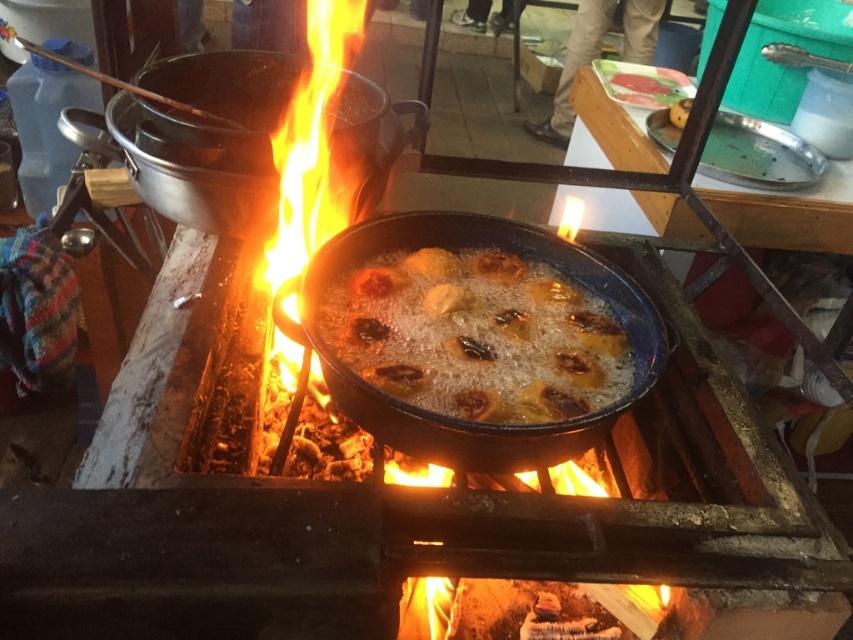
Question: Which of the following is the farthest from the observer?

Choices:
 (A) black cast iron frying pan at center
 (B) smooth yellowish-brown pastry at center

Answer: (B)

Question: Which of these objects is positioned farthest from the black cast iron frying pan at center?

Choices:
 (A) khaki fabric pants at upper center
 (B) golden crispy fried balls at center
 (C) bright orange flame at center

Answer: (A)

Question: Can you confirm if golden crispy fried balls at center is smaller than bright orange flame at center?

Choices:
 (A) no
 (B) yes

Answer: (B)

Question: Can you confirm if black cast iron frying pan at center is positioned to the left of smooth yellowish-brown pastry at center?

Choices:
 (A) yes
 (B) no

Answer: (A)

Question: Estimate the real-world distances between objects in this image. Which object is farther from the golden crispy fried balls at center?

Choices:
 (A) black cast iron frying pan at center
 (B) smooth yellowish-brown pastry at center
 (C) bright orange flame at center

Answer: (B)

Question: Does golden crispy fried balls at center have a larger size compared to smooth yellowish-brown pastry at center?

Choices:
 (A) yes
 (B) no

Answer: (A)